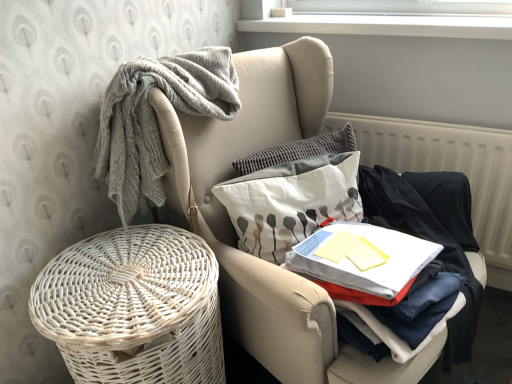
Question: Is white fabric pillow with gray floral pattern at center facing towards white wicker basket at lower left?

Choices:
 (A) yes
 (B) no

Answer: (A)

Question: Is white fabric pillow with gray floral pattern at center positioned in front of white wicker basket at lower left?

Choices:
 (A) no
 (B) yes

Answer: (A)

Question: Is white fabric pillow with gray floral pattern at center at the right side of white wicker basket at lower left?

Choices:
 (A) no
 (B) yes

Answer: (A)

Question: From a real-world perspective, is white fabric pillow with gray floral pattern at center physically above white wicker basket at lower left?

Choices:
 (A) no
 (B) yes

Answer: (B)

Question: Considering the relative positions of white fabric pillow with gray floral pattern at center and white wicker basket at lower left in the image provided, is white fabric pillow with gray floral pattern at center to the left of white wicker basket at lower left from the viewer's perspective?

Choices:
 (A) no
 (B) yes

Answer: (B)

Question: Is point (294, 213) closer or farther from the camera than point (57, 345)?

Choices:
 (A) closer
 (B) farther

Answer: (B)

Question: Considering the positions of white fabric pillow with gray floral pattern at center and white wicker basket at lower left in the image, is white fabric pillow with gray floral pattern at center taller or shorter than white wicker basket at lower left?

Choices:
 (A) tall
 (B) short

Answer: (B)

Question: In the image, is white fabric pillow with gray floral pattern at center positioned in front of or behind white wicker basket at lower left?

Choices:
 (A) behind
 (B) front

Answer: (A)

Question: Considering the relative positions of white fabric pillow with gray floral pattern at center and white wicker basket at lower left in the image provided, is white fabric pillow with gray floral pattern at center to the left or to the right of white wicker basket at lower left?

Choices:
 (A) left
 (B) right

Answer: (B)

Question: Would you say white wicker basket at lower left is inside or outside white textured radiator at right?

Choices:
 (A) inside
 (B) outside

Answer: (B)

Question: Considering their positions, is white wicker basket at lower left located in front of or behind white textured radiator at right?

Choices:
 (A) behind
 (B) front

Answer: (B)

Question: Considering the positions of white wicker basket at lower left and white textured radiator at right in the image, is white wicker basket at lower left bigger or smaller than white textured radiator at right?

Choices:
 (A) big
 (B) small

Answer: (A)

Question: From the image's perspective, is white wicker basket at lower left positioned above or below white textured radiator at right?

Choices:
 (A) above
 (B) below

Answer: (B)

Question: Do you think white fabric pillow with gray floral pattern at center is within white wicker basket at lower left, or outside of it?

Choices:
 (A) outside
 (B) inside

Answer: (B)

Question: From a real-world perspective, is white fabric pillow with gray floral pattern at center above or below white wicker basket at lower left?

Choices:
 (A) below
 (B) above

Answer: (B)